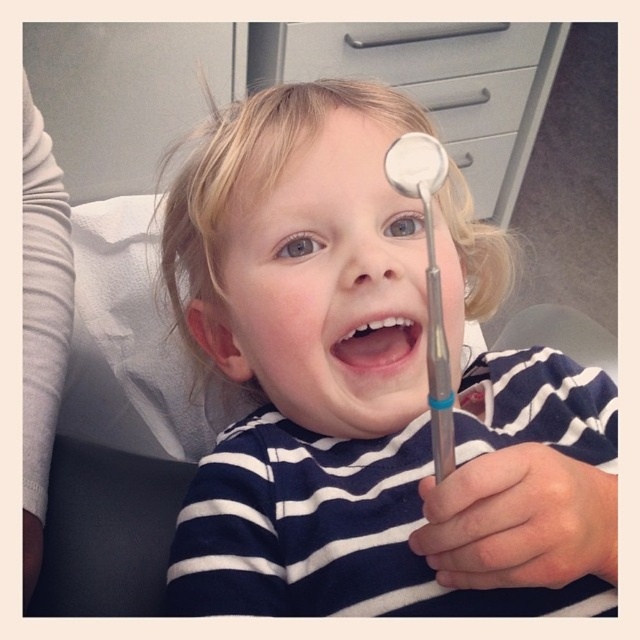
Question: Where is matte silver dental mirror at center located in relation to metallic silver mirror at upper center in the image?

Choices:
 (A) left
 (B) right

Answer: (A)

Question: Which object is closer to the camera taking this photo?

Choices:
 (A) metallic silver mirror at upper center
 (B) matte silver dental mirror at center
 (C) pink glossy lips at center

Answer: (B)

Question: Is matte silver dental mirror at center above metallic silver mirror at upper center?

Choices:
 (A) no
 (B) yes

Answer: (A)

Question: Does metallic silver mirror at upper center have a lesser width compared to pink glossy lips at center?

Choices:
 (A) yes
 (B) no

Answer: (A)

Question: Which point is closer to the camera?

Choices:
 (A) pink glossy lips at center
 (B) matte silver dental mirror at center

Answer: (B)

Question: Which point is farther to the camera?

Choices:
 (A) (323, 465)
 (B) (401, 193)

Answer: (A)